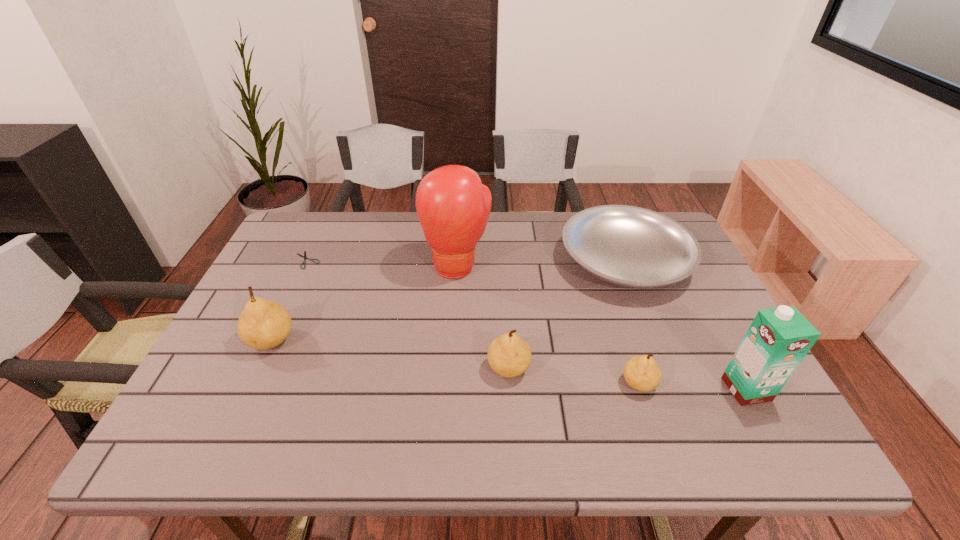
To make them evenly spaced by inserting another pear among them, please locate a free space for this new pear. Please provide its 2D coordinates. Your answer should be formatted as a tuple, i.e. [(x, y)], where the tuple contains the x and y coordinates of a point satisfying the conditions above.

[(387, 354)]